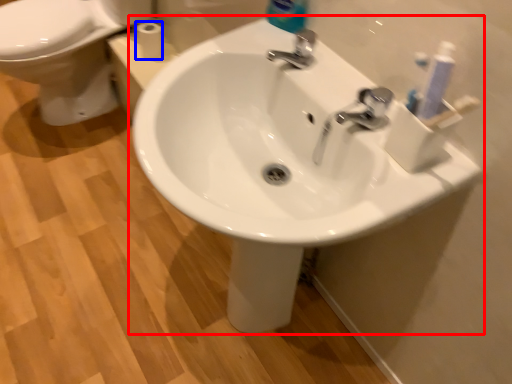
Question: Which of the following is the closest to the observer, sink (highlighted by a red box) or toilet paper (highlighted by a blue box)?

Choices:
 (A) sink
 (B) toilet paper

Answer: (A)